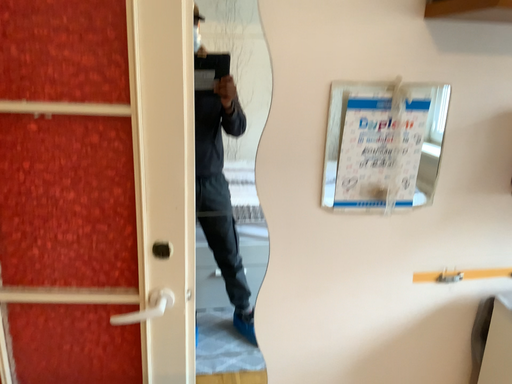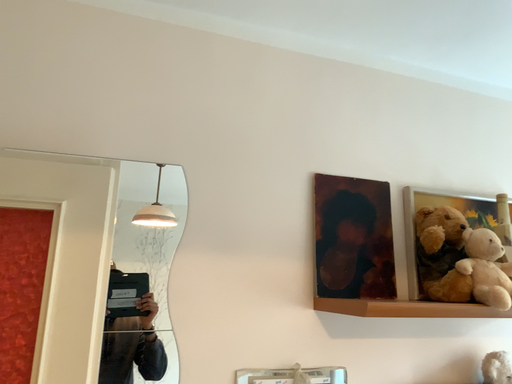
Question: Which way did the camera rotate in the video?

Choices:
 (A) rotated left
 (B) rotated right

Answer: (B)